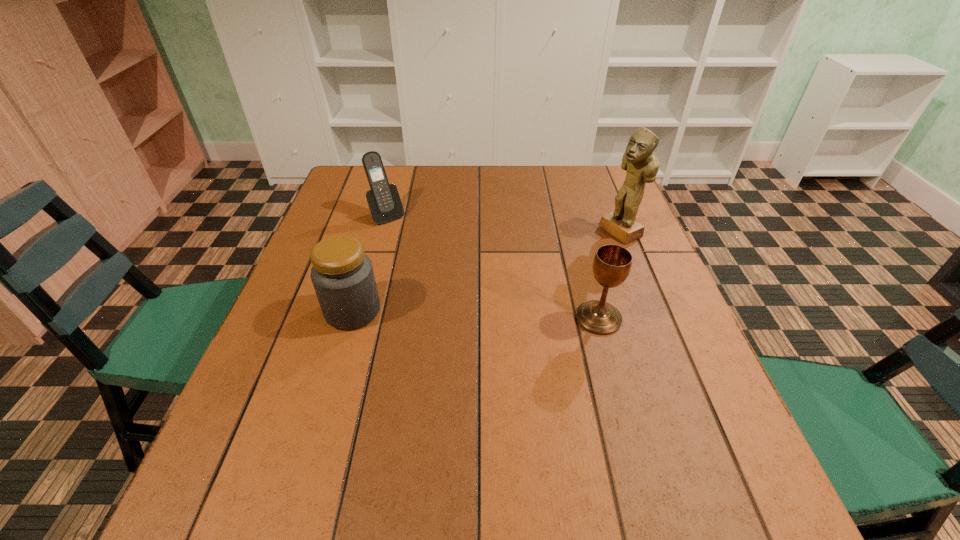
Image resolution: width=960 pixels, height=540 pixels. I want to click on free space that is in between the figurine and the cellular telephone, so click(504, 224).

At what (x,y) coordinates should I click in order to perform the action: click on free space between the cellular telephone and the third object from left to right. Please return your answer as a coordinate pair (x, y). The height and width of the screenshot is (540, 960). Looking at the image, I should click on (492, 267).

You are a GUI agent. You are given a task and a screenshot of the screen. Output one action in this format:
    pyautogui.click(x=<x>, y=<y>)
    Task: Click on the empty space that is in between the tallest object and the cellular telephone
    This screenshot has height=540, width=960.
    Given the screenshot: What is the action you would take?
    pyautogui.click(x=504, y=224)

Where is `vacant space that is in between the jar and the chalice`? The width and height of the screenshot is (960, 540). vacant space that is in between the jar and the chalice is located at coordinates (475, 314).

Identify the location of object that is the closest to the jar. Image resolution: width=960 pixels, height=540 pixels. (384, 202).

The image size is (960, 540). In order to click on object that can be found as the third closest to the third object from left to right in this screenshot , I will do `click(384, 202)`.

You are a GUI agent. You are given a task and a screenshot of the screen. Output one action in this format:
    pyautogui.click(x=<x>, y=<y>)
    Task: Click on the vacant region that satisfies the following two spatial constraints: 1. on the front side of the third object from left to right; 2. on the left side of the cellular telephone
    
    Given the screenshot: What is the action you would take?
    pyautogui.click(x=359, y=318)